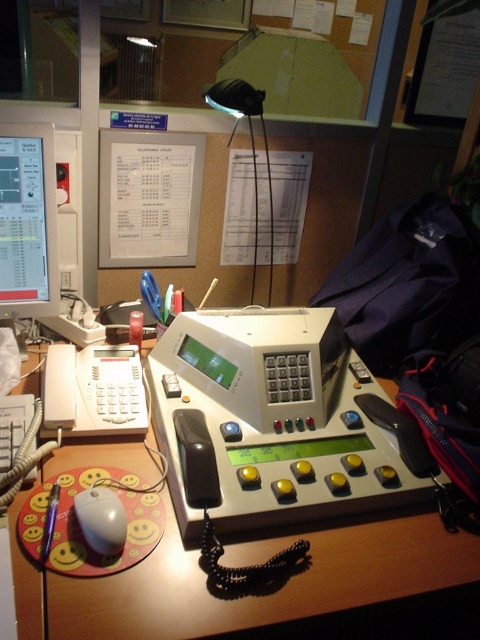
Question: Which of the following is the farthest from the observer?

Choices:
 (A) (252, 266)
 (B) (40, 134)
 (C) (71, 365)

Answer: (A)

Question: Is white plastic telephone at left smaller than white matte mouse at lower left?

Choices:
 (A) yes
 (B) no

Answer: (B)

Question: Which point appears farthest from the camera in this image?

Choices:
 (A) pos(112,528)
 (B) pos(22,212)
 (C) pos(222,104)

Answer: (C)

Question: Where is white plastic telephone at left located in relation to black plastic lamp at upper center in the image?

Choices:
 (A) below
 (B) above

Answer: (A)

Question: Is wooden desk at center smaller than white matte mouse at lower left?

Choices:
 (A) no
 (B) yes

Answer: (A)

Question: Which of the following is the farthest from the observer?

Choices:
 (A) (55, 189)
 (B) (96, 486)

Answer: (A)